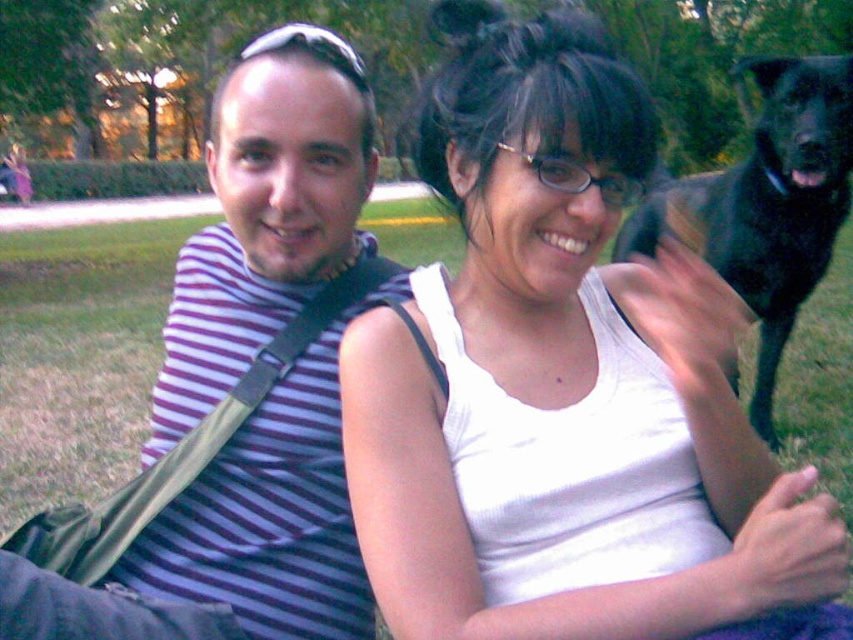
Question: Is white tank top at center further to the viewer compared to green grass at lower left?

Choices:
 (A) no
 (B) yes

Answer: (A)

Question: Estimate the real-world distances between objects in this image. Which object is closer to the green grass at lower left?

Choices:
 (A) white tank top at center
 (B) purple striped shirt at left

Answer: (A)

Question: Which object is farther from the camera taking this photo?

Choices:
 (A) green grass at lower left
 (B) purple striped shirt at left

Answer: (B)

Question: Is purple striped shirt at left to the right of black furry dog at upper right from the viewer's perspective?

Choices:
 (A) yes
 (B) no

Answer: (B)

Question: Can you confirm if black furry dog at upper right is positioned above green grass at lower left?

Choices:
 (A) yes
 (B) no

Answer: (A)

Question: Among these points, which one is nearest to the camera?

Choices:
 (A) click(593, 74)
 (B) click(373, 476)
 (C) click(793, 93)
 (D) click(341, 209)

Answer: (A)